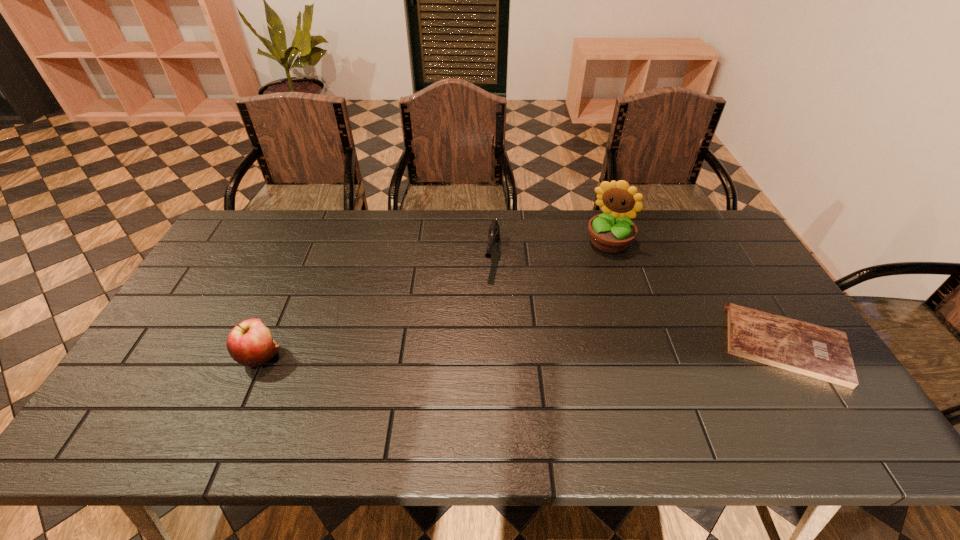
In the image, there is a desktop. Identify the location of vacant space at the near edge. The height and width of the screenshot is (540, 960). (422, 400).

In order to click on free space at the left edge of the desktop in this screenshot , I will do [x=189, y=327].

Where is `free region at the right edge of the desktop`? free region at the right edge of the desktop is located at coordinates pyautogui.click(x=745, y=259).

Where is `free space at the far left corner of the desktop`? This screenshot has height=540, width=960. free space at the far left corner of the desktop is located at coordinates (283, 218).

In order to click on vacant space at the far right corner of the desktop in this screenshot , I will do `click(698, 215)`.

I want to click on vacant space at the near right corner, so click(802, 376).

This screenshot has height=540, width=960. I want to click on vacant region between the third object from right to left and the rightmost object, so click(x=639, y=301).

Find the location of a particular element. This screenshot has height=540, width=960. vacant space that's between the Bible and the third object from left to right is located at coordinates (697, 294).

Identify the location of free space between the gun and the tallest object. Image resolution: width=960 pixels, height=540 pixels. (551, 249).

At what (x,y) coordinates should I click in order to perform the action: click on free space between the leftmost object and the third object from right to left. Please return your answer as a coordinate pair (x, y). This screenshot has height=540, width=960. Looking at the image, I should click on (376, 306).